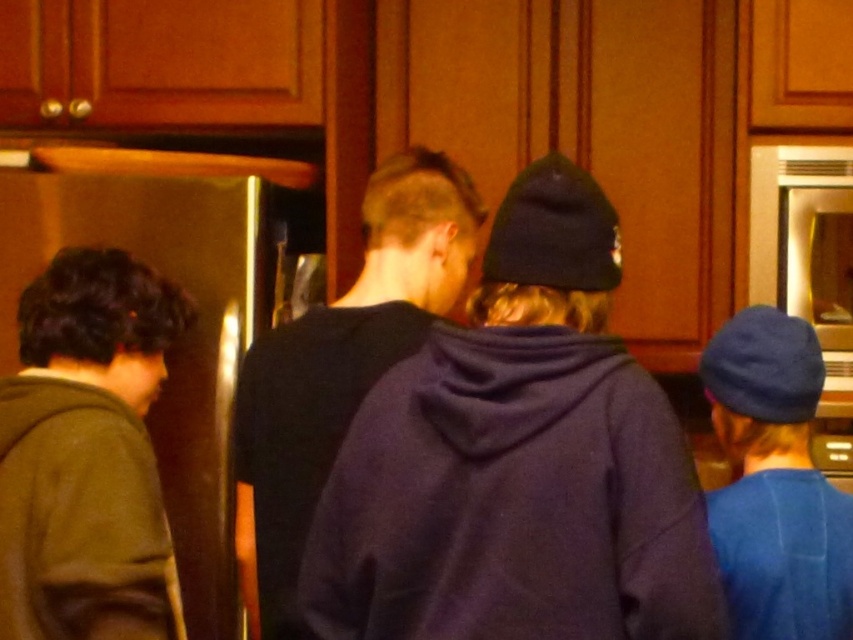
Is purple fleece hoodie at center closer to the viewer compared to green fuzzy sweater at left?

Yes, purple fleece hoodie at center is in front of green fuzzy sweater at left.

Measure the distance between point (x=422, y=458) and camera.

A distance of 1.27 meters exists between point (x=422, y=458) and camera.

Measure the distance between purple fleece hoodie at center and camera.

purple fleece hoodie at center is 1.14 meters from camera.

The height and width of the screenshot is (640, 853). What are the coordinates of `purple fleece hoodie at center` in the screenshot? It's located at (518, 461).

Between green fuzzy sweater at left and dark blue hoodie at center, which one is positioned higher?

Positioned higher is dark blue hoodie at center.

Between point (96, 547) and point (294, 442), which one is positioned in front?

Point (96, 547) is in front.

Locate an element on the screen. Image resolution: width=853 pixels, height=640 pixels. green fuzzy sweater at left is located at coordinates (85, 452).

Consider the image. Which is below, purple fleece hoodie at center or dark blue hoodie at center?

purple fleece hoodie at center is lower down.

Is point (608, 284) positioned after point (262, 525)?

No, it is not.

Does point (560, 294) come closer to viewer compared to point (245, 381)?

Yes, point (560, 294) is closer to viewer.

Locate an element on the screen. purple fleece hoodie at center is located at coordinates (518, 461).